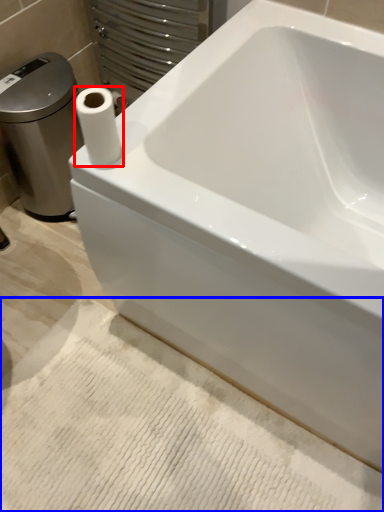
Question: Which object is closer to the camera taking this photo, paper towel (highlighted by a red box) or bath mat (highlighted by a blue box)?

Choices:
 (A) paper towel
 (B) bath mat

Answer: (A)